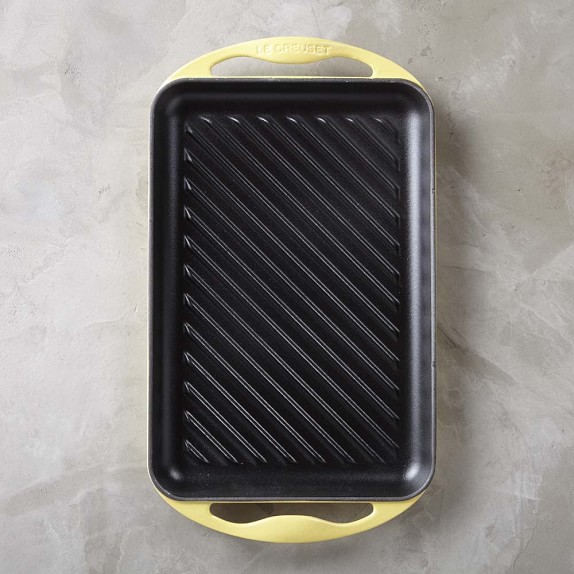
What are the coordinates of `cake pan` in the screenshot? It's located at (386, 200).